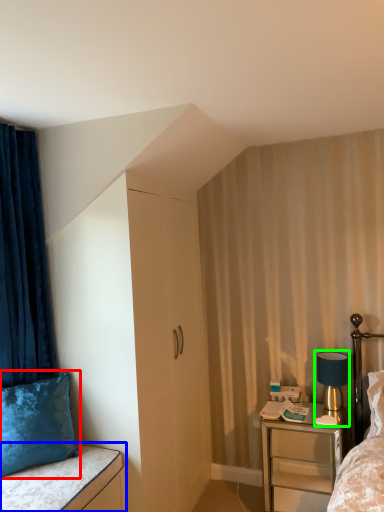
Question: Which object is positioned farthest from pillow (highlighted by a red box)? Select from vanity (highlighted by a blue box) and bedside lamp (highlighted by a green box).

Choices:
 (A) vanity
 (B) bedside lamp

Answer: (B)